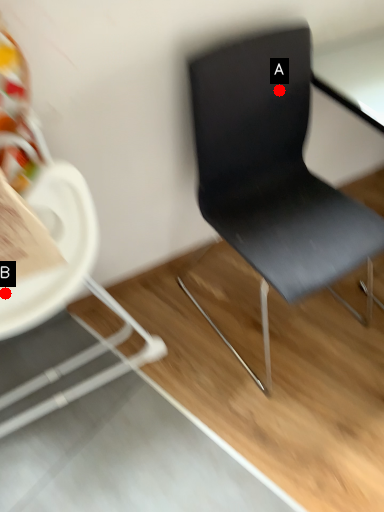
Question: Two points are circled on the image, labeled by A and B beside each circle. Which point is further to the camera?

Choices:
 (A) A is further
 (B) B is further

Answer: (A)